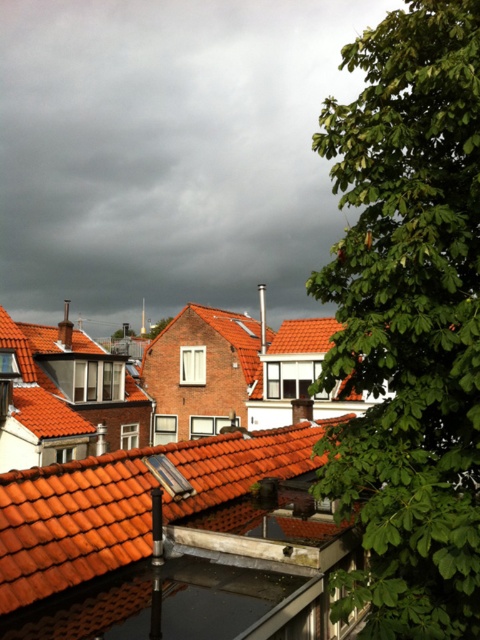
Question: Does green leafy tree at right have a smaller size compared to orange clay tiles at center?

Choices:
 (A) yes
 (B) no

Answer: (B)

Question: Is orange clay tiles at center above green leafy tree at center?

Choices:
 (A) yes
 (B) no

Answer: (B)

Question: Is orange clay tiles at center smaller than green leafy tree at center?

Choices:
 (A) no
 (B) yes

Answer: (B)

Question: Which point is farther to the camera?

Choices:
 (A) (154, 337)
 (B) (36, 572)

Answer: (A)

Question: Which point appears closest to the camera in this image?

Choices:
 (A) (158, 321)
 (B) (156, 465)
 (C) (379, 301)

Answer: (C)

Question: Which point is farther to the camera?

Choices:
 (A) green leafy tree at right
 (B) green leafy tree at center
 (C) orange clay tiles at center

Answer: (B)